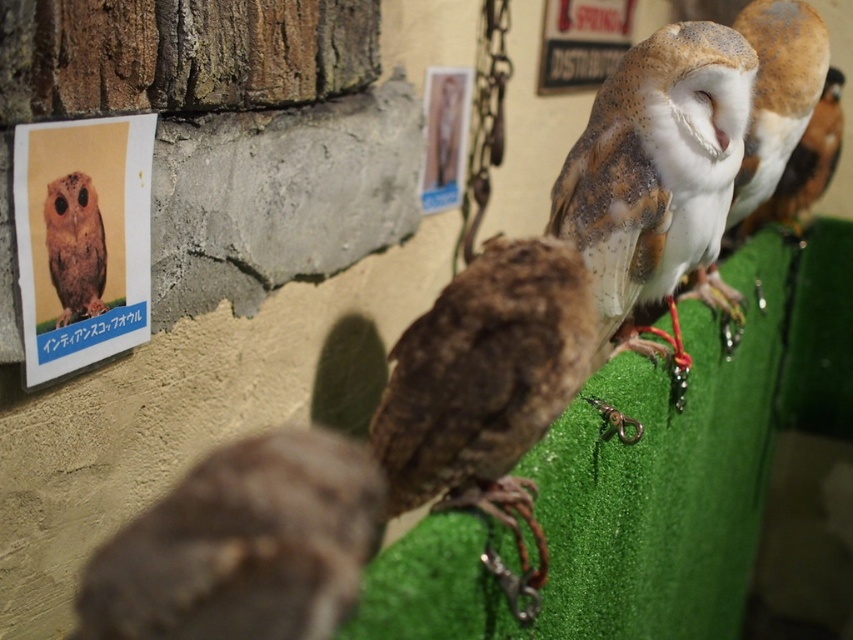
You are a zookeeper tasked with placing a new feeding station at position coordinates 0.8, 0.3. Will the feeding station interfere with the brown fuzzy owl at center?

The brown fuzzy owl at center is located at point (242, 545), so the feeding station at (254, 512) is close but not directly overlapping. However, since the coordinates are approximate, it is recommended to adjust the feeding station slightly to ensure it does not disturb the owl.

From the picture: You are a zookeeper tasked with feeding the owls. You notice the speckled feathered owl at upper right is at point (654, 170). If you start at the origin point 0,0 at the bottom left corner of the image, in which general direction should you move to reach it?

The speckled feathered owl at upper right is located at point (654, 170). Since the coordinates increase from the bottom left corner, moving towards the upper right direction would be necessary to reach it.